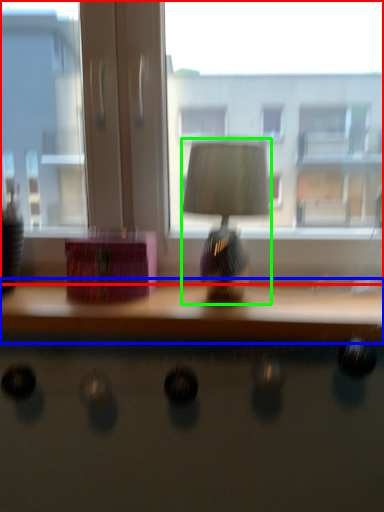
Question: Estimate the real-world distances between objects in this image. Which object is farther from window (highlighted by a red box), table (highlighted by a blue box) or table lamp (highlighted by a green box)?

Choices:
 (A) table
 (B) table lamp

Answer: (A)